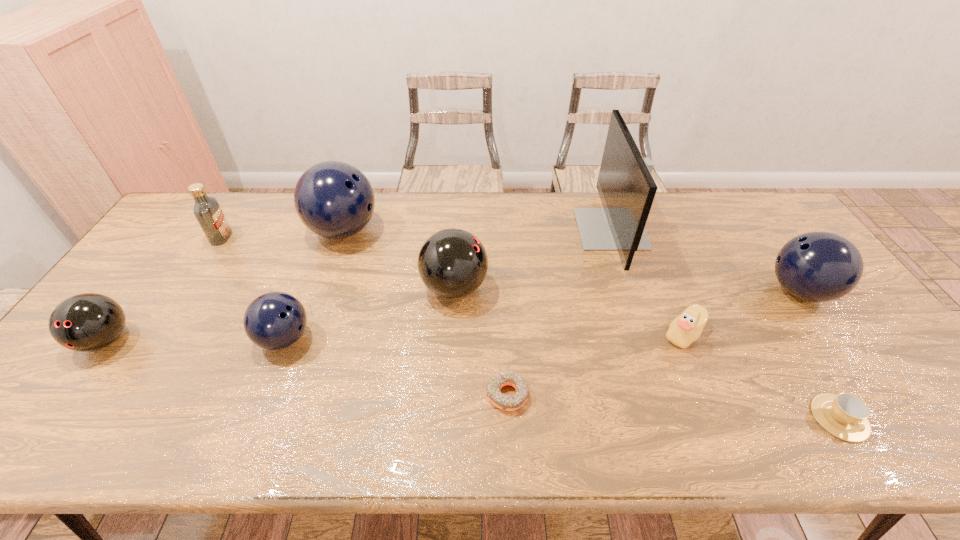
The image size is (960, 540). In order to click on vacant area at the near edge in this screenshot , I will do `click(449, 414)`.

This screenshot has width=960, height=540. I want to click on blank space at the left edge of the desktop, so click(89, 367).

Locate an element on the screen. vacant space at the right edge of the desktop is located at coordinates (845, 322).

This screenshot has height=540, width=960. I want to click on free location at the far left corner, so click(x=178, y=234).

Where is `vacant region at the near left corner of the desktop`? The width and height of the screenshot is (960, 540). vacant region at the near left corner of the desktop is located at coordinates (88, 413).

Identify the location of free space between the farther black bowling ball and the computer monitor. This screenshot has height=540, width=960. (533, 259).

You are a GUI agent. You are given a task and a screenshot of the screen. Output one action in this format:
    pyautogui.click(x=<x>, y=<y>)
    Task: Click on the free spot between the nearer black bowling ball and the computer monitor
    
    Given the screenshot: What is the action you would take?
    pyautogui.click(x=358, y=285)

The width and height of the screenshot is (960, 540). Identify the location of vacant space that is in between the biggest blue bowling ball and the computer monitor. (477, 230).

The width and height of the screenshot is (960, 540). I want to click on vacant region between the chocolate doughnut and the leftmost object, so click(x=306, y=368).

In order to click on free space between the farther black bowling ball and the vodka in this screenshot , I will do `click(338, 262)`.